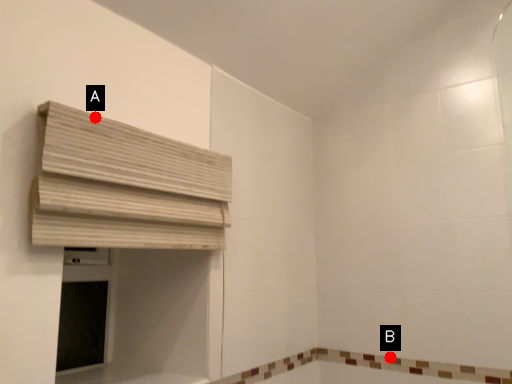
Question: Two points are circled on the image, labeled by A and B beside each circle. Which point appears closest to the camera in this image?

Choices:
 (A) A is closer
 (B) B is closer

Answer: (A)